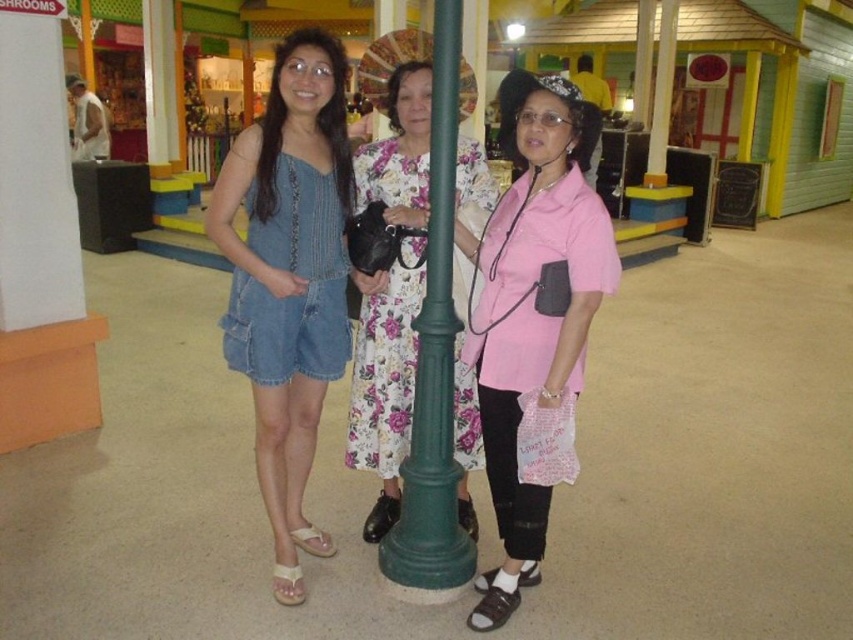
Is point (567, 344) behind point (263, 328)?

No, (567, 344) is closer to viewer.

Who is more distant from viewer, (x=512, y=81) or (x=254, y=202)?

The point (x=254, y=202) is behind.

Is point (511, 554) closer to camera compared to point (271, 493)?

Yes, point (511, 554) is in front of point (271, 493).

Locate an element on the screen. pink matte shirt at center is located at coordinates (532, 321).

Between pink matte shirt at center and floral fabric dress at center, which one has more height?

floral fabric dress at center

Is pink matte shirt at center to the right of floral fabric dress at center from the viewer's perspective?

Indeed, pink matte shirt at center is positioned on the right side of floral fabric dress at center.

Who is more forward, (477,253) or (410,406)?

Positioned in front is point (477,253).

Where is `pink matte shirt at center`? The image size is (853, 640). pink matte shirt at center is located at coordinates (532, 321).

Between point (215, 211) and point (461, 502), which one is positioned behind?

Positioned behind is point (461, 502).

Does denim romper at center appear over floral fabric dress at center?

No.

The height and width of the screenshot is (640, 853). What do you see at coordinates (289, 276) in the screenshot?
I see `denim romper at center` at bounding box center [289, 276].

This screenshot has height=640, width=853. What are the coordinates of `denim romper at center` in the screenshot? It's located at (289, 276).